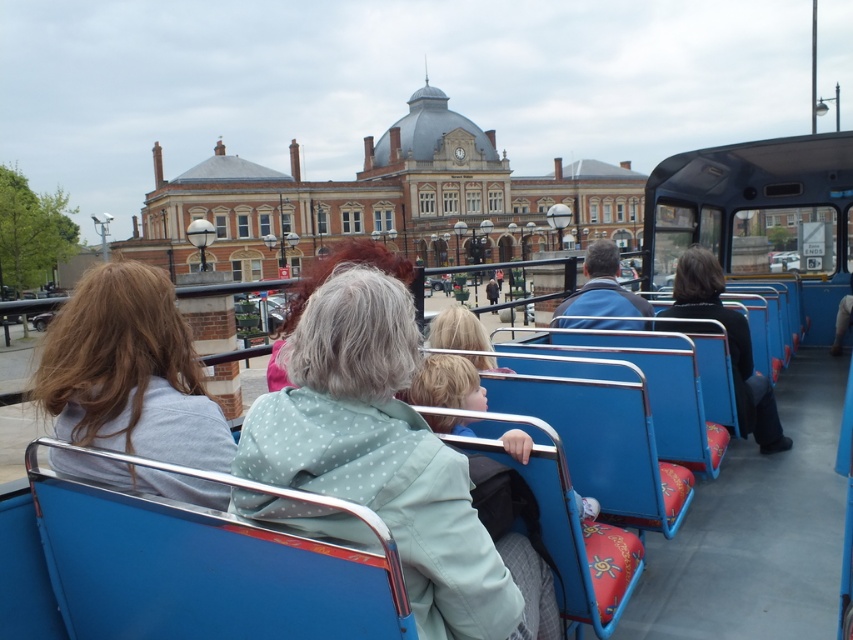
Question: Among these objects, which one is nearest to the camera?

Choices:
 (A) light green polka dot jacket at center
 (B) blue fabric coach at center
 (C) black fabric jacket at right

Answer: (A)

Question: Can you confirm if light gray fabric jacket at center is smaller than black fabric jacket at right?

Choices:
 (A) yes
 (B) no

Answer: (B)

Question: Which object is the farthest from the black fabric jacket at right?

Choices:
 (A) light gray fabric jacket at center
 (B) light green polka dot jacket at center

Answer: (A)

Question: From the image, what is the correct spatial relationship of light gray fabric jacket at center in relation to black fabric jacket at right?

Choices:
 (A) below
 (B) above

Answer: (B)

Question: Which of the following is the closest to the observer?

Choices:
 (A) (294, 438)
 (B) (706, 273)
 (C) (627, 310)

Answer: (A)

Question: Can you confirm if light gray fabric jacket at center is smaller than black fabric jacket at right?

Choices:
 (A) no
 (B) yes

Answer: (A)